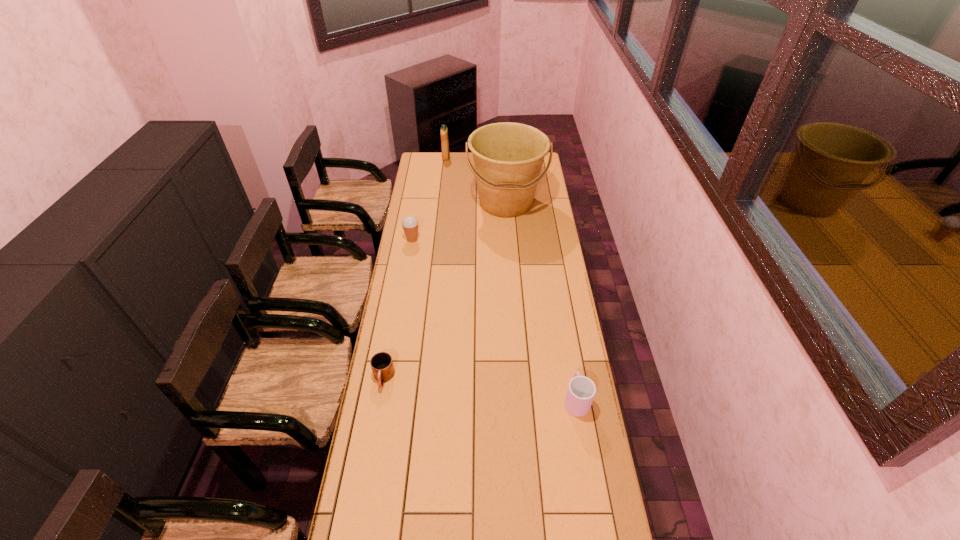
The width and height of the screenshot is (960, 540). I want to click on vacant region located 0.200m with the handle on the side of the second shortest object, so click(x=566, y=339).

Where is `vacant region located 0.080m with the handle on the side of the second shortest object`? vacant region located 0.080m with the handle on the side of the second shortest object is located at coordinates (570, 364).

This screenshot has width=960, height=540. I want to click on blank space located with the handle on the side of the second shortest object, so click(x=571, y=372).

Locate an element on the screen. blank area located 0.380m on the side of the mug with the handle is located at coordinates (361, 504).

I want to click on object at the far edge, so click(x=444, y=131).

At what (x,y) coordinates should I click in order to perform the action: click on detergent that is at the left edge. Please return your answer as a coordinate pair (x, y). The height and width of the screenshot is (540, 960). Looking at the image, I should click on (444, 131).

Find the location of a particular element. The image size is (960, 540). icecream located at the left edge is located at coordinates (410, 224).

Where is `mug present at the left edge`? mug present at the left edge is located at coordinates (381, 363).

At what (x,y) coordinates should I click in order to perform the action: click on bucket at the right edge. Please return your answer as a coordinate pair (x, y). The image size is (960, 540). Looking at the image, I should click on (508, 157).

I want to click on cup situated at the right edge, so pos(581,390).